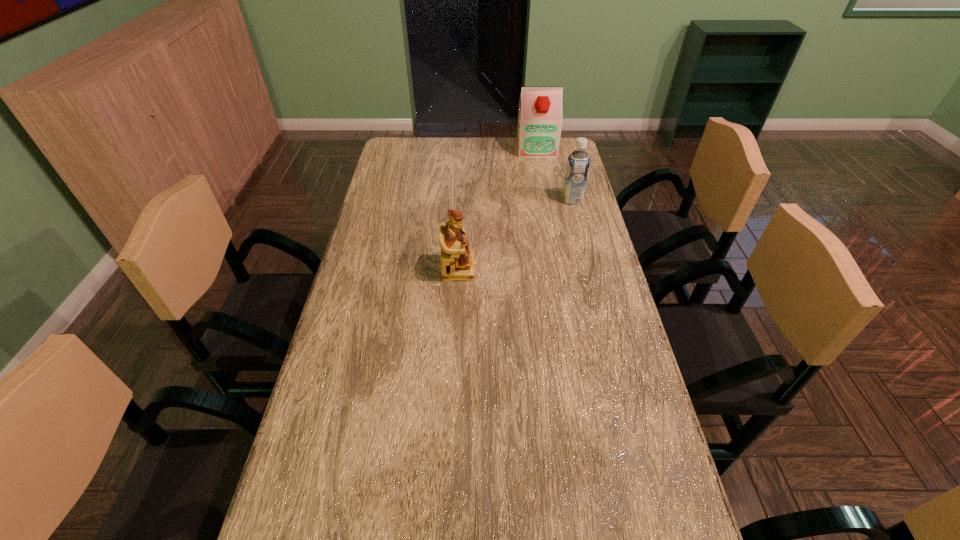
Image resolution: width=960 pixels, height=540 pixels. What are the coordinates of `the farther soya milk` in the screenshot? It's located at (539, 125).

Locate an element on the screen. the nearer soya milk is located at coordinates (578, 163).

This screenshot has height=540, width=960. I want to click on figurine, so click(457, 261).

At what (x,y) coordinates should I click in order to perform the action: click on the nearest object. Please return your answer as a coordinate pair (x, y). The width and height of the screenshot is (960, 540). Looking at the image, I should click on (457, 261).

Locate an element on the screen. This screenshot has height=540, width=960. vacant region located 0.380m with the cap open on the farthest object is located at coordinates (548, 215).

At what (x,y) coordinates should I click in order to perform the action: click on vacant region located on the label of the nearer soya milk. Please return your answer as a coordinate pair (x, y). Looking at the image, I should click on (449, 199).

This screenshot has height=540, width=960. I want to click on vacant area located 0.190m on the label of the nearer soya milk, so click(509, 199).

Find the location of a particular element. The width and height of the screenshot is (960, 540). vacant area situated 0.270m on the label of the nearer soya milk is located at coordinates (487, 199).

Where is `blank area located on the front-facing side of the nearest object`? The height and width of the screenshot is (540, 960). blank area located on the front-facing side of the nearest object is located at coordinates (541, 268).

Locate an element on the screen. The width and height of the screenshot is (960, 540). object that is at the far edge is located at coordinates (539, 125).